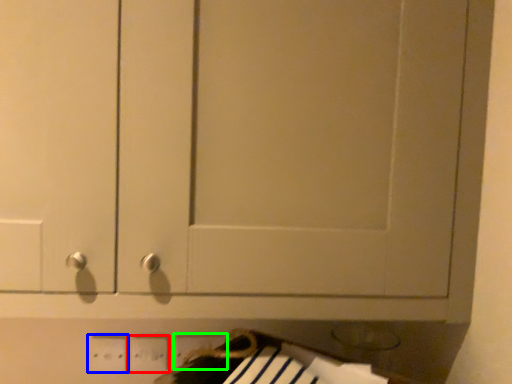
Question: Based on their relative distances, which object is farther from electric outlet (highlighted by a red box)? Choose from electric outlet (highlighted by a blue box) and electric outlet (highlighted by a green box).

Choices:
 (A) electric outlet
 (B) electric outlet

Answer: (B)